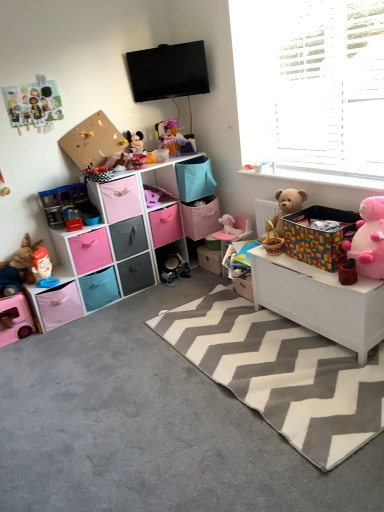
I want to click on free point to the left of gray chevron rug at center, so click(x=109, y=411).